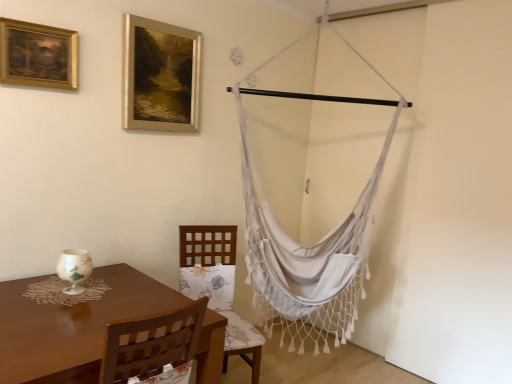
Identify the location of gold-framed painting at upper left, the second picture frame when ordered from back to front. (38, 55).

What is the approximate height of gold-framed painting at upper left, positioned as the first picture frame in front-to-back order?

32.85 centimeters.

Image resolution: width=512 pixels, height=384 pixels. I want to click on brown wooden table at lower left, so click(x=71, y=324).

You are a GUI agent. You are given a task and a screenshot of the screen. Output one action in this format:
    pyautogui.click(x=<x>, y=<y>)
    Task: Click on the gold metallic picture frame at upper center, which appears as the 1th picture frame when viewed from the back
    The height and width of the screenshot is (384, 512).
    Given the screenshot: What is the action you would take?
    pyautogui.click(x=160, y=76)

Can you confirm if woodenchair at center is taller than white macrame hammock at right?

In fact, woodenchair at center may be shorter than white macrame hammock at right.

In the scene shown: Is woodenchair at center oriented towards white macrame hammock at right?

No, woodenchair at center is not facing towards white macrame hammock at right.

Between woodenchair at center and white macrame hammock at right, which one has smaller width?

Thinner between the two is white macrame hammock at right.

Measure the distance between woodenchair at center and white macrame hammock at right.

woodenchair at center and white macrame hammock at right are 17.72 inches apart.

Is gold-framed painting at upper left, the second picture frame in the right-to-left sequence, inside or outside of gold metallic picture frame at upper center, placed as the first picture frame when sorted from right to left?

gold-framed painting at upper left, the second picture frame in the right-to-left sequence, is spatially situated outside gold metallic picture frame at upper center, placed as the first picture frame when sorted from right to left.

I want to click on picture frame that appears behind the gold-framed painting at upper left, which appears as the first picture frame when viewed from the left, so click(x=160, y=76).

Between gold-framed painting at upper left, the second picture frame when ordered from back to front, and gold metallic picture frame at upper center, which ranks as the second picture frame in left-to-right order, which one is positioned behind?

gold metallic picture frame at upper center, which ranks as the second picture frame in left-to-right order.

In terms of width, does gold-framed painting at upper left, the second picture frame in the right-to-left sequence, look wider or thinner when compared to gold metallic picture frame at upper center, placed as the first picture frame when sorted from right to left?

Clearly, gold-framed painting at upper left, the second picture frame in the right-to-left sequence, has less width compared to gold metallic picture frame at upper center, placed as the first picture frame when sorted from right to left.

Does gold-framed painting at upper left, the second picture frame when ordered from back to front, have a smaller size compared to brown wooden table at lower left?

Indeed, gold-framed painting at upper left, the second picture frame when ordered from back to front, has a smaller size compared to brown wooden table at lower left.

Does gold-framed painting at upper left, the second picture frame when ordered from back to front, touch brown wooden table at lower left?

gold-framed painting at upper left, the second picture frame when ordered from back to front, is not next to brown wooden table at lower left, and they're not touching.

From a real-world perspective, between gold-framed painting at upper left, positioned as the first picture frame in front-to-back order, and brown wooden table at lower left, who is vertically higher?

gold-framed painting at upper left, positioned as the first picture frame in front-to-back order, from a real-world perspective.

From the image's perspective, which is below, gold metallic picture frame at upper center, which appears as the 1th picture frame when viewed from the back, or white macrame hammock at right?

white macrame hammock at right is shown below in the image.

Can you confirm if gold metallic picture frame at upper center, placed as the first picture frame when sorted from right to left, is positioned to the left of white macrame hammock at right?

Yes, gold metallic picture frame at upper center, placed as the first picture frame when sorted from right to left, is to the left of white macrame hammock at right.

Does gold metallic picture frame at upper center, which ranks as the second picture frame in left-to-right order, turn towards white macrame hammock at right?

No, gold metallic picture frame at upper center, which ranks as the second picture frame in left-to-right order, is not turned towards white macrame hammock at right.

How much distance is there between gold metallic picture frame at upper center, which ranks as the second picture frame in left-to-right order, and white macrame hammock at right?

gold metallic picture frame at upper center, which ranks as the second picture frame in left-to-right order, is 33.73 inches from white macrame hammock at right.

From the image's perspective, relative to gold metallic picture frame at upper center, which is counted as the second picture frame, starting from the front, is woodenchair at center above or below?

From the image's perspective, woodenchair at center appears below gold metallic picture frame at upper center, which is counted as the second picture frame, starting from the front.

Which picture frame is the 1st one when counting from the left side of the woodenchair at center? Please provide its 2D coordinates.

[(160, 76)]

Between woodenchair at center and gold metallic picture frame at upper center, which appears as the 1th picture frame when viewed from the back, which one is positioned behind?

gold metallic picture frame at upper center, which appears as the 1th picture frame when viewed from the back, is more distant.

Considering the points (184, 274) and (190, 55), which point is in front, point (184, 274) or point (190, 55)?

Positioned in front is point (190, 55).

Can we say gold metallic picture frame at upper center, which ranks as the second picture frame in left-to-right order, lies outside brown wooden table at lower left?

gold metallic picture frame at upper center, which ranks as the second picture frame in left-to-right order, lies outside brown wooden table at lower left's area.

Who is shorter, gold metallic picture frame at upper center, which ranks as the second picture frame in left-to-right order, or brown wooden table at lower left?

gold metallic picture frame at upper center, which ranks as the second picture frame in left-to-right order, is shorter.

Is point (162, 79) farther from viewer compared to point (53, 332)?

Yes, it is behind point (53, 332).

Where is `chair located underneath the gold metallic picture frame at upper center, which ranks as the second picture frame in left-to-right order (from a real-world perspective)`? The image size is (512, 384). chair located underneath the gold metallic picture frame at upper center, which ranks as the second picture frame in left-to-right order (from a real-world perspective) is located at coordinates (218, 286).

Considering the relative sizes of gold metallic picture frame at upper center, which ranks as the second picture frame in left-to-right order, and woodenchair at center in the image provided, is gold metallic picture frame at upper center, which ranks as the second picture frame in left-to-right order, shorter than woodenchair at center?

Yes.

Is gold metallic picture frame at upper center, placed as the first picture frame when sorted from right to left, next to woodenchair at center and touching it?

No, gold metallic picture frame at upper center, placed as the first picture frame when sorted from right to left, is not making contact with woodenchair at center.

Is point (185, 34) farther from camera compared to point (224, 257)?

No.

Locate an element on the screen. This screenshot has height=384, width=512. chair that is on the left side of white macrame hammock at right is located at coordinates (218, 286).

This screenshot has width=512, height=384. Find the location of `picture frame above the gold metallic picture frame at upper center, which appears as the 1th picture frame when viewed from the back (from a real-world perspective)`. picture frame above the gold metallic picture frame at upper center, which appears as the 1th picture frame when viewed from the back (from a real-world perspective) is located at coordinates (38, 55).

Which object lies nearer to the anchor point gold metallic picture frame at upper center, which appears as the 1th picture frame when viewed from the back, white macrame hammock at right or woodenchair at center?

white macrame hammock at right.

Looking at the image, which one is located closer to gold-framed painting at upper left, the second picture frame when ordered from back to front, gold metallic picture frame at upper center, which appears as the 1th picture frame when viewed from the back, or woodenchair at center?

Among the two, gold metallic picture frame at upper center, which appears as the 1th picture frame when viewed from the back, is located nearer to gold-framed painting at upper left, the second picture frame when ordered from back to front.

Based on their spatial positions, is woodenchair at center or brown wooden table at lower left further from gold metallic picture frame at upper center, which is counted as the second picture frame, starting from the front?

brown wooden table at lower left is positioned further to the anchor gold metallic picture frame at upper center, which is counted as the second picture frame, starting from the front.

When comparing their distances from woodenchair at center, does brown wooden table at lower left or white macrame hammock at right seem closer?

white macrame hammock at right.

Which object lies further to the anchor point white macrame hammock at right, gold metallic picture frame at upper center, which appears as the 1th picture frame when viewed from the back, or gold-framed painting at upper left, which appears as the first picture frame when viewed from the left?

Among the two, gold-framed painting at upper left, which appears as the first picture frame when viewed from the left, is located further to white macrame hammock at right.

Looking at the image, which one is located closer to gold metallic picture frame at upper center, which is counted as the second picture frame, starting from the front, white macrame hammock at right or gold-framed painting at upper left, which appears as the first picture frame when viewed from the left?

gold-framed painting at upper left, which appears as the first picture frame when viewed from the left.

From the image, which object appears to be nearer to gold-framed painting at upper left, positioned as the first picture frame in front-to-back order, brown wooden table at lower left or white macrame hammock at right?

Among the two, brown wooden table at lower left is located nearer to gold-framed painting at upper left, positioned as the first picture frame in front-to-back order.

When comparing their distances from white macrame hammock at right, does brown wooden table at lower left or gold metallic picture frame at upper center, which appears as the 1th picture frame when viewed from the back, seem further?

Among the two, brown wooden table at lower left is located further to white macrame hammock at right.

This screenshot has height=384, width=512. In order to click on chair that lies between gold metallic picture frame at upper center, which ranks as the second picture frame in left-to-right order, and brown wooden table at lower left from top to bottom in this screenshot , I will do `click(218, 286)`.

Where is `picture frame between gold-framed painting at upper left, positioned as the first picture frame in front-to-back order, and white macrame hammock at right from left to right`? picture frame between gold-framed painting at upper left, positioned as the first picture frame in front-to-back order, and white macrame hammock at right from left to right is located at coordinates (160, 76).

Find the location of a particular element. This screenshot has width=512, height=384. picture frame that lies between gold metallic picture frame at upper center, which appears as the 1th picture frame when viewed from the back, and woodenchair at center from top to bottom is located at coordinates (38, 55).

The image size is (512, 384). Identify the location of curtain between gold metallic picture frame at upper center, which ranks as the second picture frame in left-to-right order, and woodenchair at center from top to bottom. (307, 260).